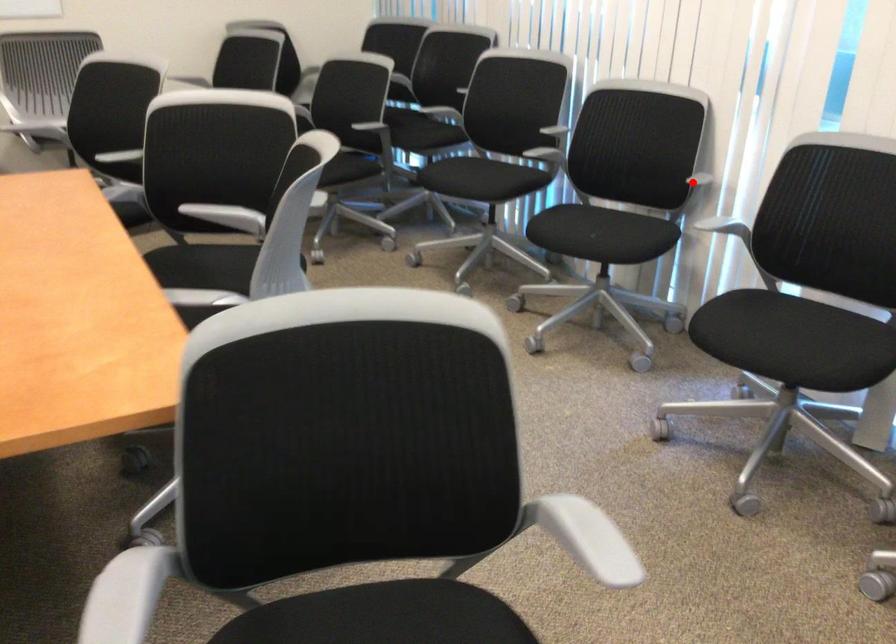
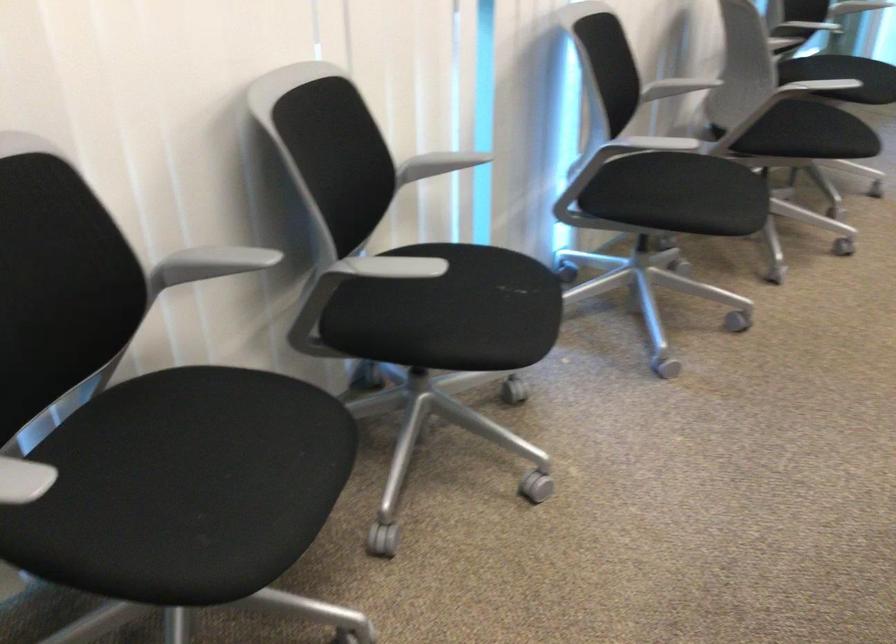
Locate, in the second image, the point that corresponds to the highlighted location in the first image.

(438, 164)